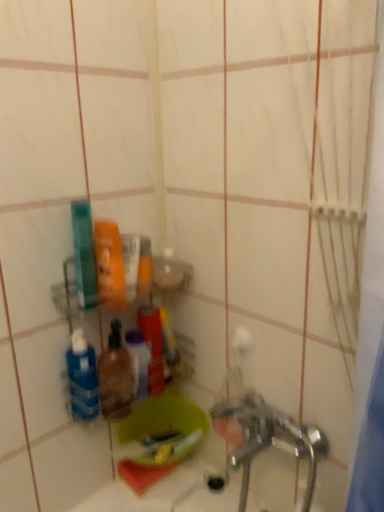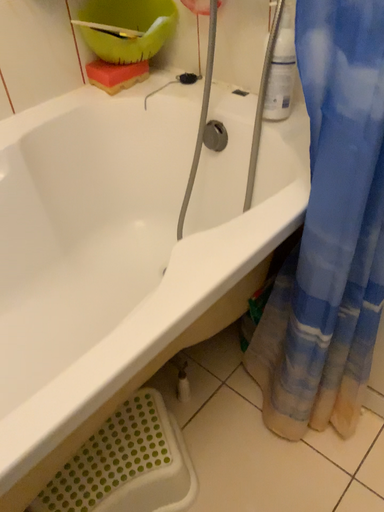
Question: How did the camera likely rotate when shooting the video?

Choices:
 (A) rotated upward
 (B) rotated downward

Answer: (B)